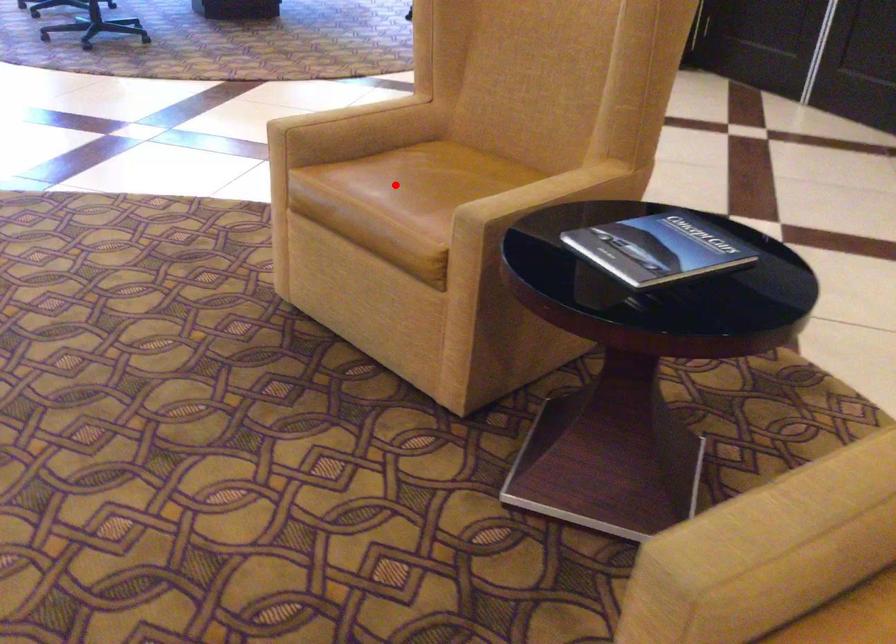
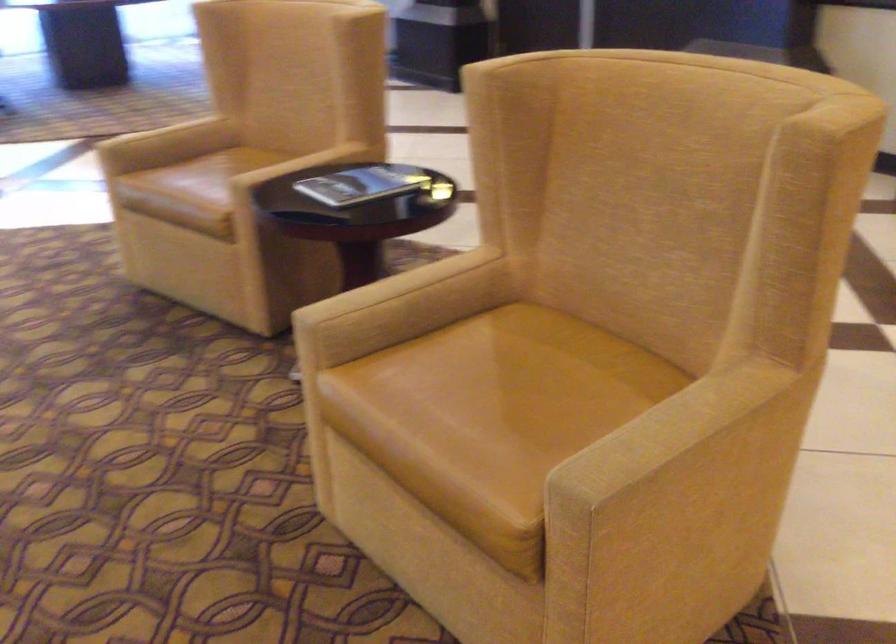
Question: I am providing you with two images of the same scene from different viewpoints. A red point is shown in image1. For the corresponding object point in image2, is it positioned nearer or farther from the camera?

Choices:
 (A) Nearer
 (B) Farther

Answer: (B)